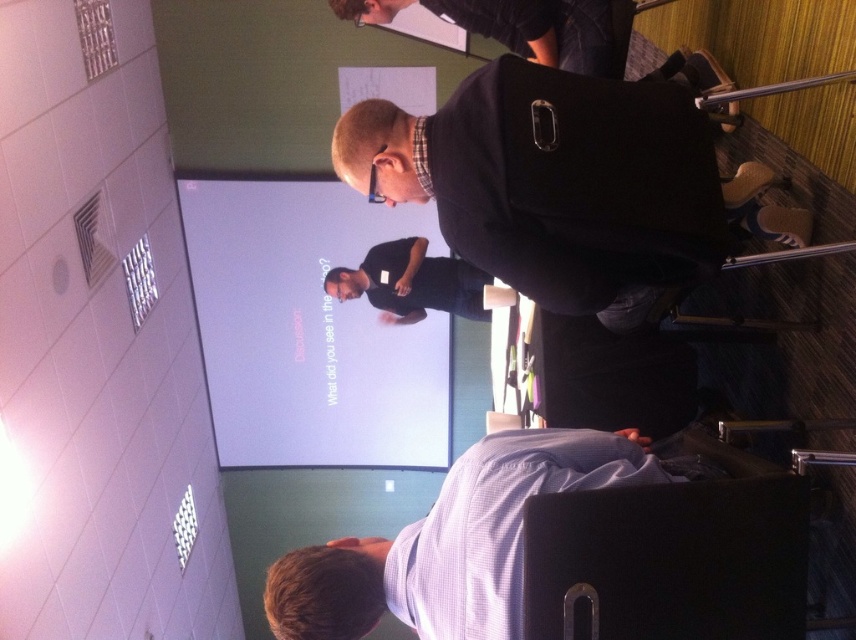
You are organizing a workshop and need to place a new poster on the wall. The poster is the size of the black fabric bag at upper center. Is there enough space on the wall next to the black matte shirt at center?

The black fabric bag at upper center occupies less space than the black matte shirt at center. Therefore, the poster can fit in the space next to the black matte shirt at center since it has more available space.